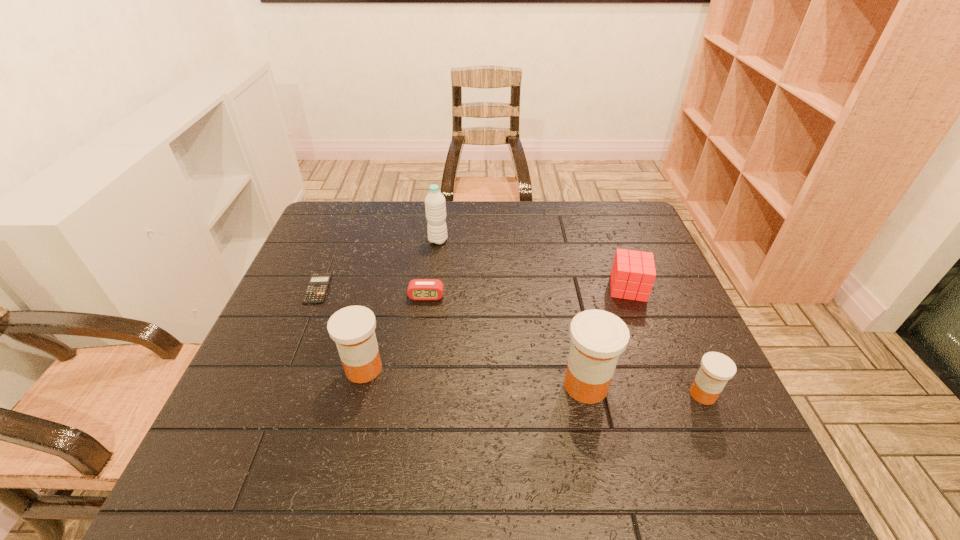
Identify which object is the fourth nearest to the farthest object. Please provide its 2D coordinates. Your answer should be formatted as a tuple, i.e. [(x, y)], where the tuple contains the x and y coordinates of a point satisfying the conditions above.

[(633, 273)]

Identify the location of medicine that can be found as the second closest to the farthest object. The image size is (960, 540). (598, 337).

Identify which medicine is the second nearest to the third object from right to left. Please provide its 2D coordinates. Your answer should be formatted as a tuple, i.e. [(x, y)], where the tuple contains the x and y coordinates of a point satisfying the conditions above.

[(352, 328)]

You are a GUI agent. You are given a task and a screenshot of the screen. Output one action in this format:
    pyautogui.click(x=<x>, y=<y>)
    Task: Click on the vacant space that satisfies the following two spatial constraints: 1. on the back side of the leftmost object; 2. on the right side of the cube
    The width and height of the screenshot is (960, 540).
    Given the screenshot: What is the action you would take?
    pyautogui.click(x=318, y=288)